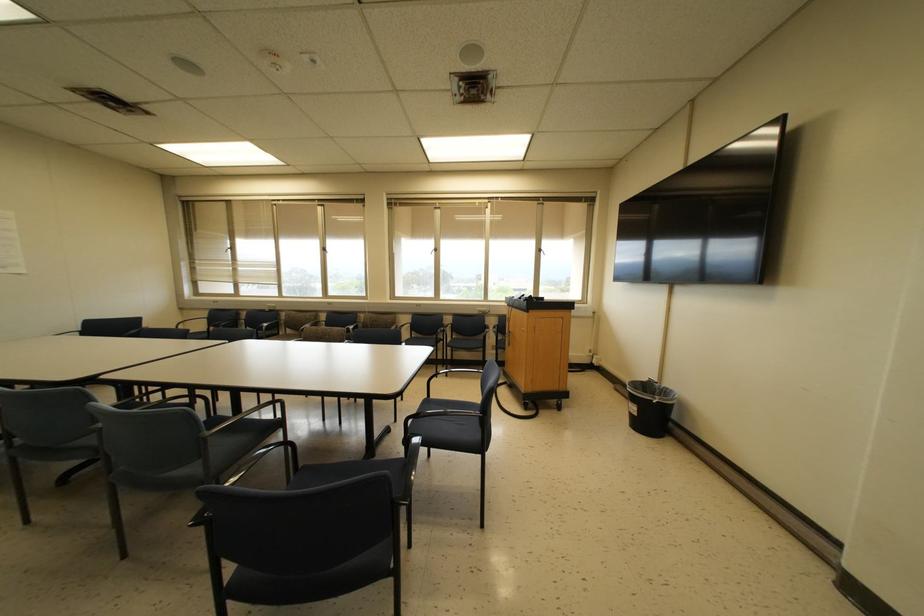
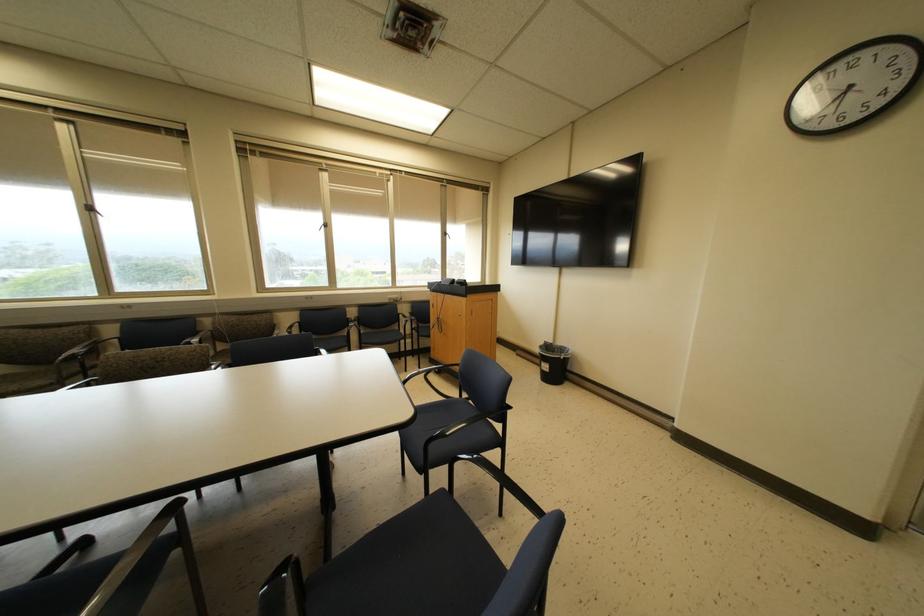
In the second image, find the point that corresponds to (322,249) in the first image.

(89, 208)